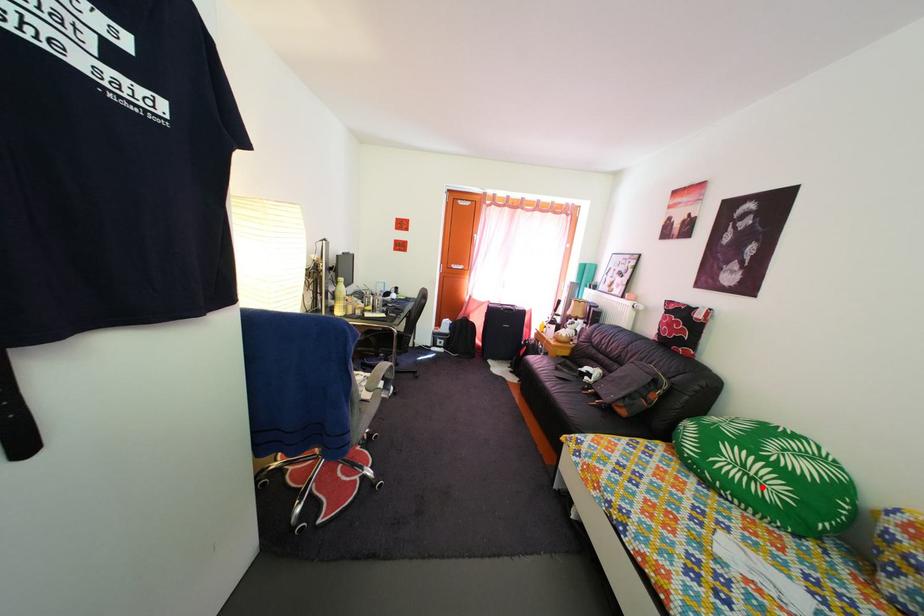
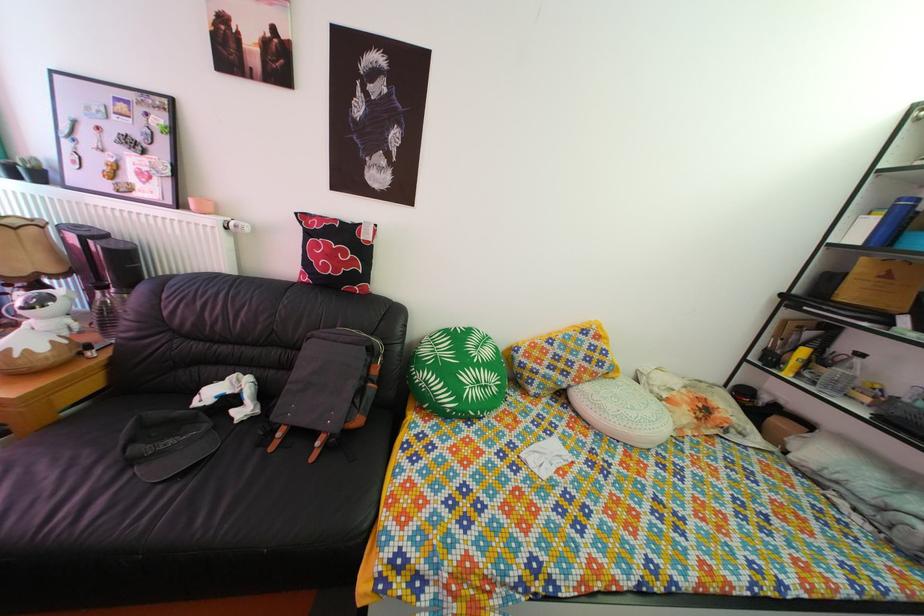
In the second image, find the point that corresponds to the highlighted location in the first image.

(494, 395)